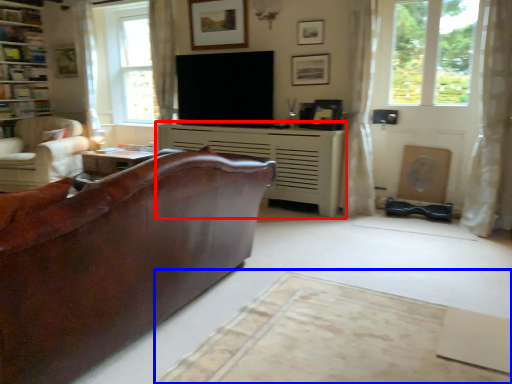
Question: Which object appears closest to the camera in this image, fireplace (highlighted by a red box) or plain (highlighted by a blue box)?

Choices:
 (A) fireplace
 (B) plain

Answer: (B)